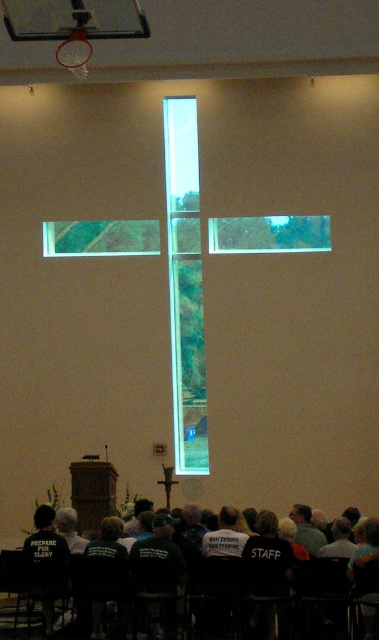
Who is more distant from viewer, (176, 387) or (241, 611)?

The point (176, 387) is more distant.

Is clear glass cross at center thinner than black fabric shirt at lower center?

Indeed, clear glass cross at center has a lesser width compared to black fabric shirt at lower center.

This screenshot has height=640, width=379. Describe the element at coordinates (184, 285) in the screenshot. I see `clear glass cross at center` at that location.

Where is `clear glass cross at center`? clear glass cross at center is located at coordinates (184, 285).

Can you confirm if black fabric shirt at lower center is positioned below transparent glass window at center?

Indeed, black fabric shirt at lower center is positioned under transparent glass window at center.

The width and height of the screenshot is (379, 640). What do you see at coordinates (256, 579) in the screenshot?
I see `black fabric shirt at lower center` at bounding box center [256, 579].

Locate an element on the screen. black fabric shirt at lower center is located at coordinates [x=256, y=579].

Does transparent glass window at center have a lesser height compared to transparent glass cross at upper center?

No, transparent glass window at center is not shorter than transparent glass cross at upper center.

Looking at this image, does transparent glass window at center have a larger size compared to transparent glass cross at upper center?

Incorrect, transparent glass window at center is not larger than transparent glass cross at upper center.

Who is more distant from viewer, (289,225) or (112,253)?

The point (112,253) is behind.

Locate an element on the screen. transparent glass window at center is located at coordinates (269, 234).